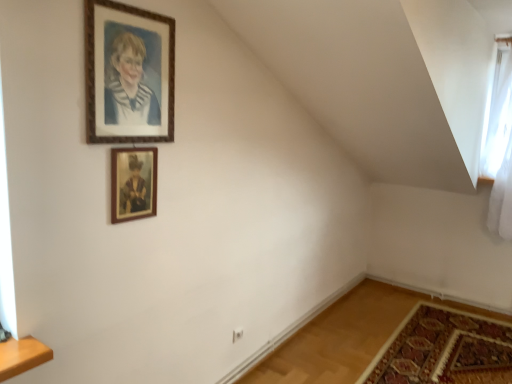
Question: Is wooden picture frame at upper center, the 2th picture frame positioned from the top, touching carpeted mat at lower right?

Choices:
 (A) no
 (B) yes

Answer: (A)

Question: Can you confirm if wooden picture frame at upper center, the 2th picture frame positioned from the top, is positioned to the right of carpeted mat at lower right?

Choices:
 (A) yes
 (B) no

Answer: (B)

Question: Would you consider wooden picture frame at upper center, the first picture frame from the bottom, to be distant from carpeted mat at lower right?

Choices:
 (A) no
 (B) yes

Answer: (B)

Question: Considering the relative positions of wooden picture frame at upper center, the 2th picture frame positioned from the top, and carpeted mat at lower right in the image provided, is wooden picture frame at upper center, the 2th picture frame positioned from the top, in front of carpeted mat at lower right?

Choices:
 (A) yes
 (B) no

Answer: (A)

Question: From a real-world perspective, is wooden picture frame at upper center, the 2th picture frame positioned from the top, positioned over carpeted mat at lower right based on gravity?

Choices:
 (A) no
 (B) yes

Answer: (B)

Question: Is wooden picture frame at upper center, the 2th picture frame positioned from the top, completely or partially outside of carpeted mat at lower right?

Choices:
 (A) yes
 (B) no

Answer: (A)

Question: Is carpeted mat at lower right at the back of wooden frame at upper center, the 2th picture frame from the bottom?

Choices:
 (A) yes
 (B) no

Answer: (B)

Question: Is wooden frame at upper center, the 2th picture frame from the bottom, further to camera compared to carpeted mat at lower right?

Choices:
 (A) yes
 (B) no

Answer: (B)

Question: Can carpeted mat at lower right be found inside wooden frame at upper center, the 2th picture frame from the bottom?

Choices:
 (A) yes
 (B) no

Answer: (B)

Question: Can you confirm if wooden frame at upper center, the 2th picture frame from the bottom, is shorter than carpeted mat at lower right?

Choices:
 (A) no
 (B) yes

Answer: (A)

Question: Could you tell me if wooden frame at upper center, the 1th picture frame from the top, is turned towards carpeted mat at lower right?

Choices:
 (A) yes
 (B) no

Answer: (B)

Question: Is wooden frame at upper center, the 2th picture frame from the bottom, to the left of carpeted mat at lower right from the viewer's perspective?

Choices:
 (A) no
 (B) yes

Answer: (B)

Question: From a real-world perspective, is carpeted mat at lower right on white sheer curtain at upper right?

Choices:
 (A) no
 (B) yes

Answer: (A)